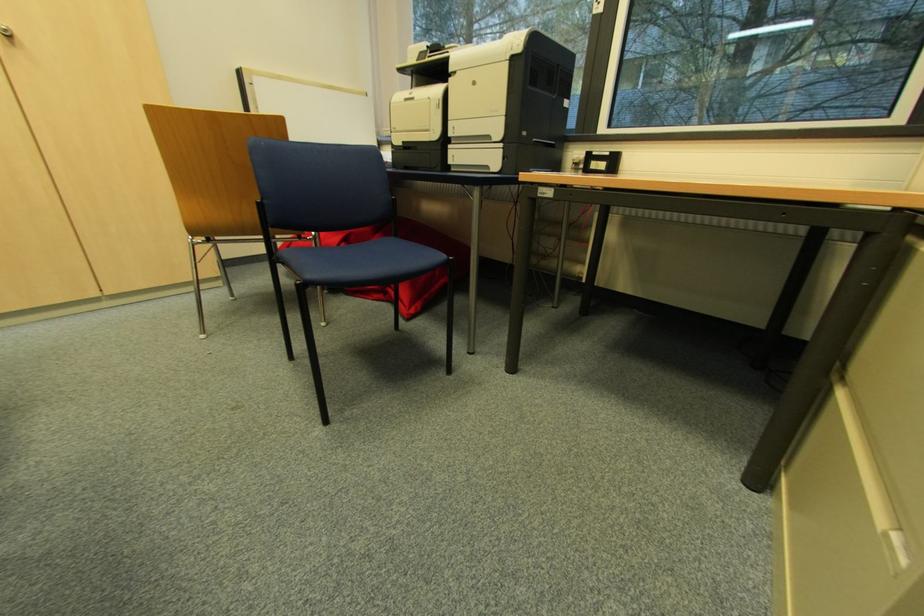
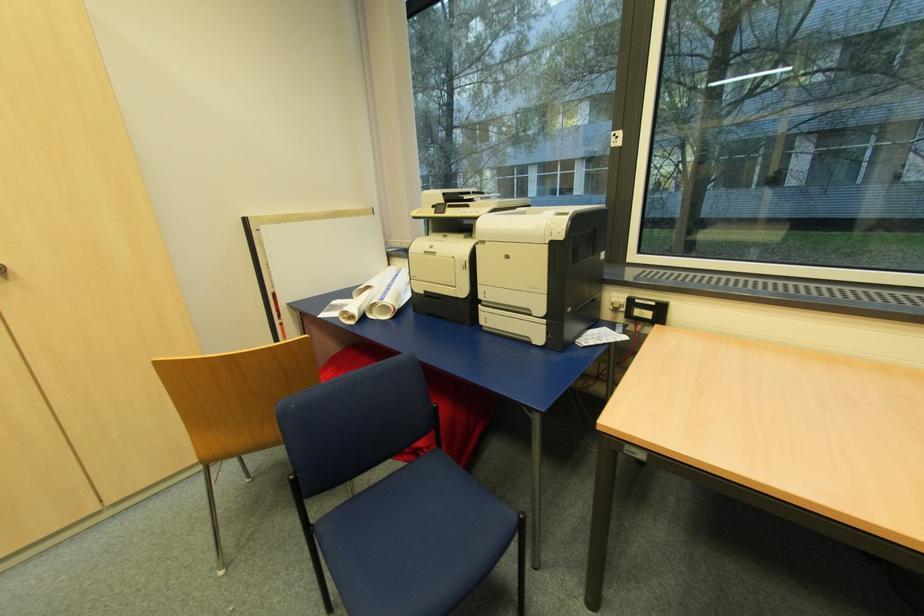
Question: The images are taken continuously from a first-person perspective. In which direction is your viewpoint rotating?

Choices:
 (A) Left
 (B) Right
 (C) Up
 (D) Down

Answer: (C)